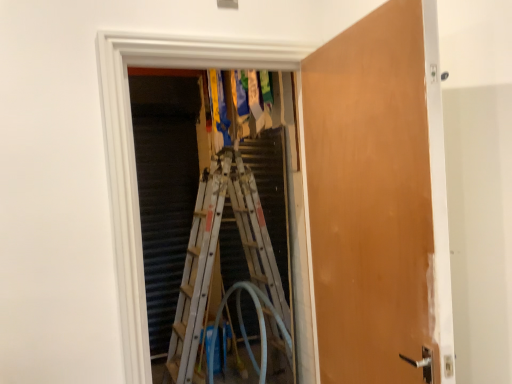
In order to face wooden door at center, should I rotate leftwards or rightwards?

It's best to rotate right around 13.732 degrees.

You are a GUI agent. You are given a task and a screenshot of the screen. Output one action in this format:
    pyautogui.click(x=<x>, y=<y>)
    Task: Click on the translucent rubber garden hose at center
    
    Given the screenshot: What is the action you would take?
    point(245,330)

Where is `white metallic ladder at center`? The image size is (512, 384). white metallic ladder at center is located at coordinates (234, 243).

Is white metallic ladder at center positioned with its back to translucent rubber garden hose at center?

Yes, translucent rubber garden hose at center is at the back of white metallic ladder at center.

Is white metallic ladder at center far from translucent rubber garden hose at center?

No, white metallic ladder at center is in close proximity to translucent rubber garden hose at center.

Would you say white metallic ladder at center is outside translucent rubber garden hose at center?

Yes, white metallic ladder at center is not within translucent rubber garden hose at center.

Considering the relative sizes of white metallic ladder at center and translucent rubber garden hose at center in the image provided, is white metallic ladder at center thinner than translucent rubber garden hose at center?

Correct, the width of white metallic ladder at center is less than that of translucent rubber garden hose at center.

In the scene shown: From the image's perspective, which object appears higher, wooden door at center or white metallic ladder at center?

wooden door at center is shown above in the image.

Which is more to the left, wooden door at center or white metallic ladder at center?

From the viewer's perspective, white metallic ladder at center appears more on the left side.

What's the angular difference between wooden door at center and white metallic ladder at center's facing directions?

5.28 degrees.

Is wooden door at center placed right next to white metallic ladder at center?

No.

At what (x,y) coordinates should I click in order to perform the action: click on garden hose on the left of wooden door at center. Please return your answer as a coordinate pair (x, y). Looking at the image, I should click on (245, 330).

Can you confirm if translucent rubber garden hose at center is shorter than wooden door at center?

Yes, translucent rubber garden hose at center is shorter than wooden door at center.

Is translucent rubber garden hose at center wider or thinner than wooden door at center?

In the image, translucent rubber garden hose at center appears to be wider than wooden door at center.

Considering the relative positions of translucent rubber garden hose at center and wooden door at center in the image provided, is translucent rubber garden hose at center to the right of wooden door at center from the viewer's perspective?

No.

How many degrees apart are the facing directions of translucent rubber garden hose at center and white metallic ladder at center?

translucent rubber garden hose at center and white metallic ladder at center are facing 1.18 degrees away from each other.

Which of these two, translucent rubber garden hose at center or white metallic ladder at center, stands shorter?

Standing shorter between the two is translucent rubber garden hose at center.

Is translucent rubber garden hose at center far from white metallic ladder at center?

No.

Could you tell me if wooden door at center is turned towards translucent rubber garden hose at center?

No, wooden door at center is not facing towards translucent rubber garden hose at center.

Between wooden door at center and translucent rubber garden hose at center, which one is positioned in front?

wooden door at center is more forward.

From the image's perspective, does wooden door at center appear lower than translucent rubber garden hose at center?

No.

Would you say white metallic ladder at center is a long distance from wooden door at center?

Absolutely, white metallic ladder at center is distant from wooden door at center.

Between white metallic ladder at center and wooden door at center, which one has larger size?

white metallic ladder at center.

The image size is (512, 384). Find the location of `ladder below the wooden door at center (from a real-world perspective)`. ladder below the wooden door at center (from a real-world perspective) is located at coordinates (234, 243).

From the image's perspective, is white metallic ladder at center above wooden door at center?

No, from the image's perspective, white metallic ladder at center is not on top of wooden door at center.

You are a GUI agent. You are given a task and a screenshot of the screen. Output one action in this format:
    pyautogui.click(x=<x>, y=<y>)
    Task: Click on the ladder above the translucent rubber garden hose at center (from the image's perspective)
    The height and width of the screenshot is (384, 512).
    Given the screenshot: What is the action you would take?
    pyautogui.click(x=234, y=243)

Locate an element on the screen. door that is above the white metallic ladder at center (from a real-world perspective) is located at coordinates (378, 198).

Estimate the real-world distances between objects in this image. Which object is further from translucent rubber garden hose at center, wooden door at center or white metallic ladder at center?

Based on the image, wooden door at center appears to be further to translucent rubber garden hose at center.

Estimate the real-world distances between objects in this image. Which object is further from white metallic ladder at center, translucent rubber garden hose at center or wooden door at center?

wooden door at center is positioned further to the anchor white metallic ladder at center.

Looking at the image, which one is located further to white metallic ladder at center, wooden door at center or translucent rubber garden hose at center?

wooden door at center is positioned further to the anchor white metallic ladder at center.

Based on their spatial positions, is translucent rubber garden hose at center or white metallic ladder at center further from wooden door at center?

white metallic ladder at center lies further to wooden door at center than the other object.

When comparing their distances from translucent rubber garden hose at center, does white metallic ladder at center or wooden door at center seem closer?

white metallic ladder at center is positioned closer to the anchor translucent rubber garden hose at center.

Considering their positions, is white metallic ladder at center positioned closer to wooden door at center than translucent rubber garden hose at center?

The object closer to wooden door at center is translucent rubber garden hose at center.

The height and width of the screenshot is (384, 512). I want to click on garden hose between wooden door at center and white metallic ladder at center from front to back, so click(x=245, y=330).